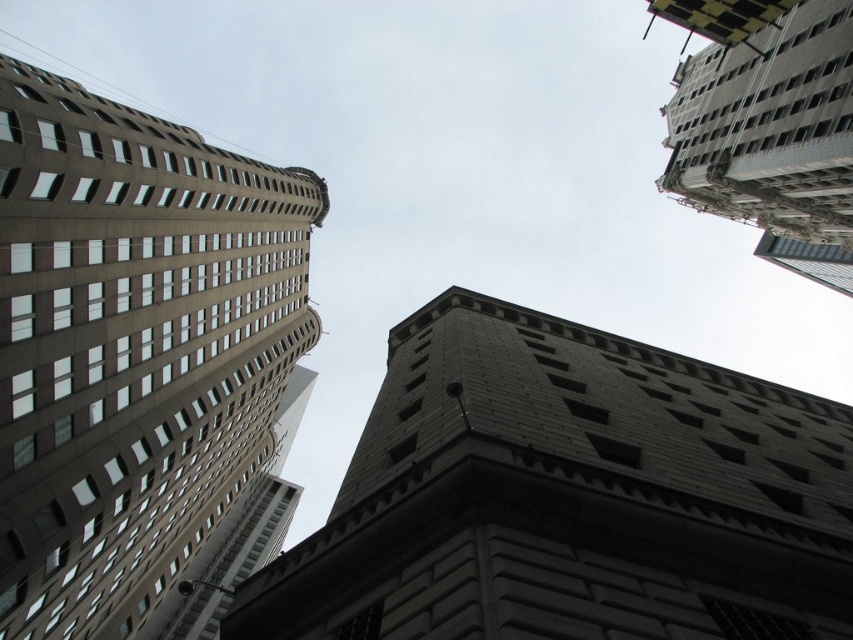
Can you confirm if brown concrete building at left is thinner than gray concrete building at upper right?

Yes, brown concrete building at left is thinner than gray concrete building at upper right.

Is brown concrete building at left below gray concrete building at upper right?

Yes.

Describe the element at coordinates (132, 348) in the screenshot. The width and height of the screenshot is (853, 640). I see `brown concrete building at left` at that location.

At what (x,y) coordinates should I click in order to perform the action: click on brown concrete building at left. Please return your answer as a coordinate pair (x, y). Looking at the image, I should click on (132, 348).

Which is above, gray stone tower at center or brown concrete building at left?

brown concrete building at left is higher up.

Does gray stone tower at center lie behind brown concrete building at left?

No, gray stone tower at center is closer to the viewer.

Between point (361, 595) and point (3, 484), which one is positioned behind?

Point (3, 484)

Where is `gray stone tower at center`? The width and height of the screenshot is (853, 640). gray stone tower at center is located at coordinates (569, 497).

Does gray stone tower at center appear over gray concrete building at upper right?

No, gray stone tower at center is not above gray concrete building at upper right.

Does gray stone tower at center have a lesser width compared to gray concrete building at upper right?

Yes.

Identify the location of gray stone tower at center. (569, 497).